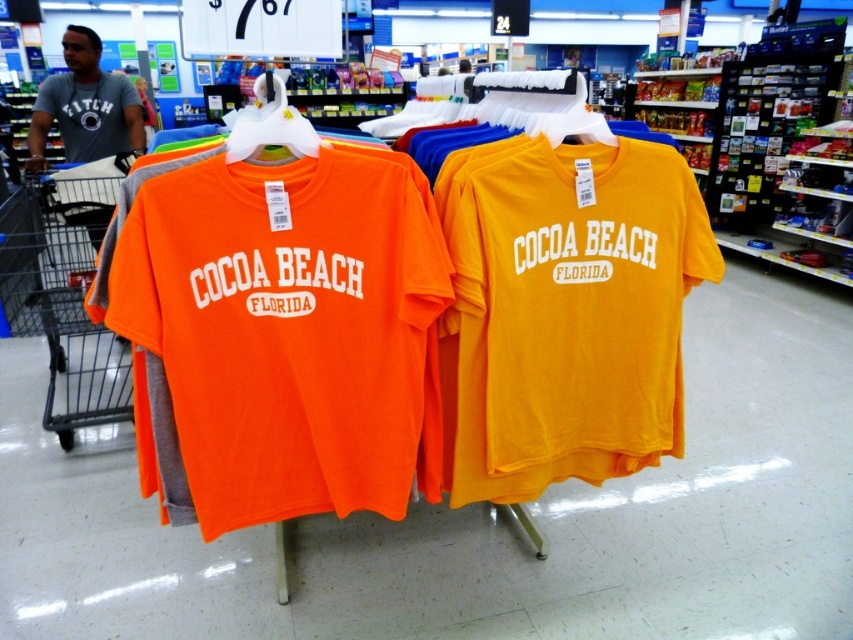
Question: Is metallic gray shopping cart at lower left bigger than gray cotton shirt at upper left?

Choices:
 (A) no
 (B) yes

Answer: (B)

Question: Which object appears farthest from the camera in this image?

Choices:
 (A) gray cotton shirt at upper left
 (B) orange matte t-shirt at center
 (C) metallic gray shopping cart at lower left
 (D) matte yellow t-shirt at center

Answer: (A)

Question: Which of the following is the farthest from the observer?

Choices:
 (A) pyautogui.click(x=80, y=378)
 (B) pyautogui.click(x=86, y=76)
 (C) pyautogui.click(x=236, y=356)
 (D) pyautogui.click(x=689, y=193)

Answer: (B)

Question: Is matte yellow t-shirt at center to the left of metallic gray shopping cart at lower left from the viewer's perspective?

Choices:
 (A) no
 (B) yes

Answer: (A)

Question: Which object appears farthest from the camera in this image?

Choices:
 (A) orange matte t-shirt at center
 (B) gray cotton shirt at upper left

Answer: (B)

Question: Does orange matte t-shirt at center appear over gray cotton shirt at upper left?

Choices:
 (A) yes
 (B) no

Answer: (B)